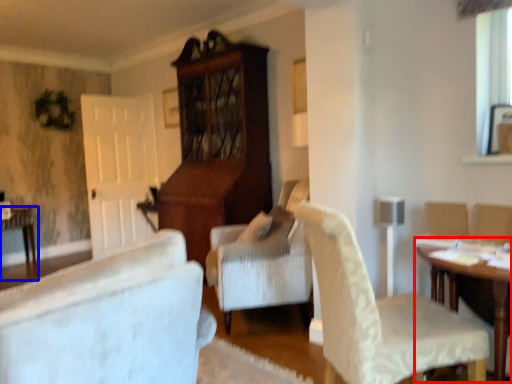
Question: Which of the following is the closest to the observer, table (highlighted by a red box) or table (highlighted by a blue box)?

Choices:
 (A) table
 (B) table

Answer: (A)